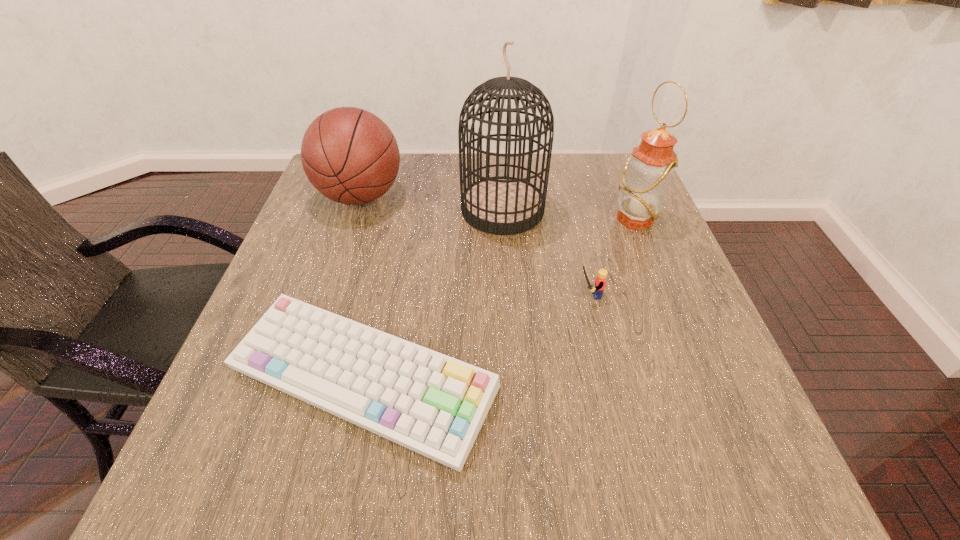
Where is `free area in between the third tallest object and the birdcage`? The height and width of the screenshot is (540, 960). free area in between the third tallest object and the birdcage is located at coordinates (432, 203).

Locate an element on the screen. The height and width of the screenshot is (540, 960). free spot between the tallest object and the basketball is located at coordinates (432, 203).

Locate an element on the screen. The image size is (960, 540). free space between the second nearest object and the second tallest object is located at coordinates (612, 257).

Image resolution: width=960 pixels, height=540 pixels. Find the location of `vacant point located between the Lego and the birdcage`. vacant point located between the Lego and the birdcage is located at coordinates (545, 252).

The width and height of the screenshot is (960, 540). Identify the location of unoccupied position between the tallest object and the fourth shortest object. (568, 214).

The image size is (960, 540). In order to click on vacant area that lies between the rightmost object and the shortest object in this screenshot , I will do `click(499, 299)`.

Identify the location of free space between the nearest object and the second nearest object. (475, 338).

What are the coordinates of `vacant area that lies between the Lego and the third tallest object` in the screenshot? It's located at (474, 246).

Locate which object is the closest to the oil lamp. Please provide its 2D coordinates. Your answer should be formatted as a tuple, i.e. [(x, y)], where the tuple contains the x and y coordinates of a point satisfying the conditions above.

[(501, 205)]

Choose which object is the fourth nearest neighbor to the fourth shortest object. Please provide its 2D coordinates. Your answer should be formatted as a tuple, i.e. [(x, y)], where the tuple contains the x and y coordinates of a point satisfying the conditions above.

[(349, 155)]